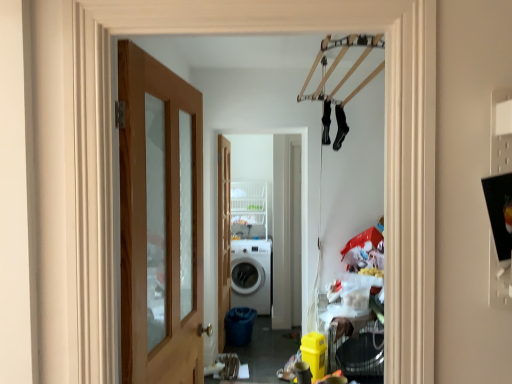
Question: Is white glossy washing machine at center completely or partially outside of wooden door at left, marked as the 2th door in a back-to-front arrangement?

Choices:
 (A) no
 (B) yes

Answer: (B)

Question: From a real-world perspective, is white glossy washing machine at center beneath wooden door at left, marked as the 2th door in a back-to-front arrangement?

Choices:
 (A) no
 (B) yes

Answer: (B)

Question: From the image's perspective, would you say white glossy washing machine at center is positioned over wooden door at left, which is counted as the first door, starting from the front?

Choices:
 (A) yes
 (B) no

Answer: (B)

Question: Considering the relative sizes of white glossy washing machine at center and wooden door at left, marked as the 2th door in a back-to-front arrangement, in the image provided, is white glossy washing machine at center taller than wooden door at left, marked as the 2th door in a back-to-front arrangement,?

Choices:
 (A) yes
 (B) no

Answer: (A)

Question: Is white glossy washing machine at center at the right side of wooden door at left, which is counted as the first door, starting from the front?

Choices:
 (A) yes
 (B) no

Answer: (A)

Question: Considering the relative sizes of white glossy washing machine at center and wooden door at left, which is counted as the first door, starting from the front, in the image provided, is white glossy washing machine at center thinner than wooden door at left, which is counted as the first door, starting from the front,?

Choices:
 (A) no
 (B) yes

Answer: (A)

Question: Could wooden door at center, placed as the 2th door when sorted from front to back, be considered to be inside white wire shelf at center?

Choices:
 (A) yes
 (B) no

Answer: (B)

Question: From a real-world perspective, is white wire shelf at center over wooden door at center, placed as the 2th door when sorted from front to back?

Choices:
 (A) no
 (B) yes

Answer: (B)

Question: Is white wire shelf at center closer to camera compared to wooden door at center, placed as the 2th door when sorted from front to back?

Choices:
 (A) yes
 (B) no

Answer: (B)

Question: Considering the relative sizes of white wire shelf at center and wooden door at center, arranged as the 1th door when viewed from the back, in the image provided, is white wire shelf at center wider than wooden door at center, arranged as the 1th door when viewed from the back,?

Choices:
 (A) yes
 (B) no

Answer: (A)

Question: Can you confirm if white wire shelf at center is thinner than wooden door at center, arranged as the 1th door when viewed from the back?

Choices:
 (A) yes
 (B) no

Answer: (B)

Question: Could you tell me if white wire shelf at center is turned towards wooden door at center, placed as the 2th door when sorted from front to back?

Choices:
 (A) no
 (B) yes

Answer: (B)

Question: Considering the relative positions of white matte washing machine at center and wooden door at center, arranged as the 1th door when viewed from the back, in the image provided, is white matte washing machine at center behind wooden door at center, arranged as the 1th door when viewed from the back,?

Choices:
 (A) no
 (B) yes

Answer: (B)